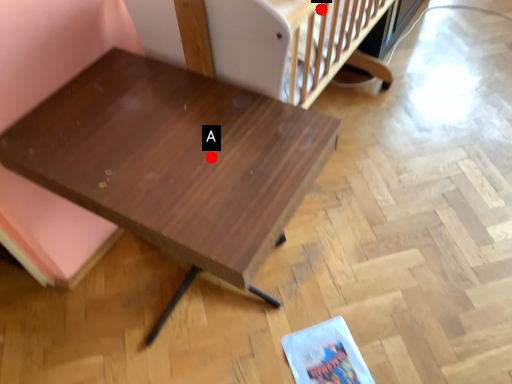
Question: Two points are circled on the image, labeled by A and B beside each circle. Which point is further to the camera?

Choices:
 (A) A is further
 (B) B is further

Answer: (B)